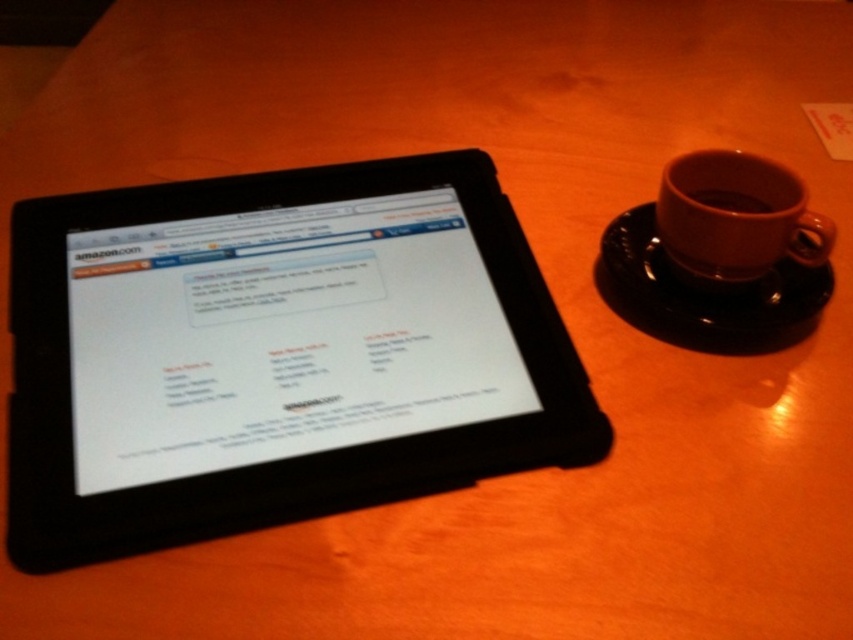
You are trying to place a small spoon on the wooden table next to the tablet. The spoon is 5 cm long. The point where you want to place it is at coordinates [704,292]. Is there enough space there to place the spoon without it overlapping the tablet or the saucer?

The point [704,292] corresponds to the black ceramic saucer at right, so placing the spoon there would overlap with the saucer. Choose another spot away from the saucer and tablet for sufficient space.

You are a delivery robot with a 12 inch wide package. You need to place it on the table between the black matte tablet at left and the brown matte cup at right. Is there enough space between them to place your package without moving either object?

The black matte tablet at left and brown matte cup at right are 14.45 inches apart from each other. Since the package is 12 inches wide, there is enough space between them to place the package without moving either object.

You are organizing a small desk space and need to place both the black matte tablet at left and the brown matte cup at right. Given their sizes, which object should you prioritize placing first to ensure they both fit comfortably on the desk?

The black matte tablet at left is bigger than the brown matte cup at right, so you should prioritize placing the black matte tablet at left first to ensure there is enough space for both items on the desk.